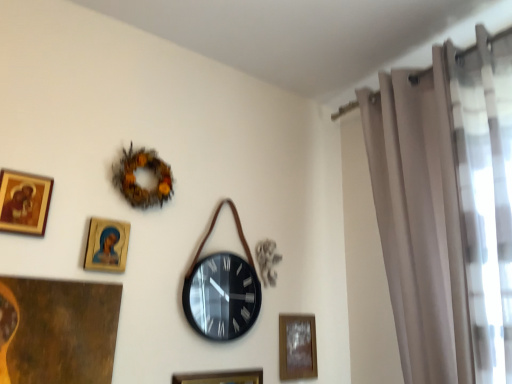
Question: Does beige sheer curtain at right have a greater height compared to wooden glossy picture frame at upper left, which is the 2th picture frame in top-to-bottom order?

Choices:
 (A) yes
 (B) no

Answer: (A)

Question: From the image's perspective, does beige sheer curtain at right appear lower than wooden glossy picture frame at upper left, the 3th picture frame positioned from the back?

Choices:
 (A) no
 (B) yes

Answer: (A)

Question: From a real-world perspective, is beige sheer curtain at right on wooden glossy picture frame at upper left, the 3th picture frame positioned from the back?

Choices:
 (A) no
 (B) yes

Answer: (B)

Question: Can you confirm if beige sheer curtain at right is positioned to the right of wooden glossy picture frame at upper left, which appears as the third picture frame when ordered from the bottom?

Choices:
 (A) no
 (B) yes

Answer: (B)

Question: Can you confirm if beige sheer curtain at right is shorter than wooden glossy picture frame at upper left, the 3th picture frame positioned from the back?

Choices:
 (A) no
 (B) yes

Answer: (A)

Question: Would you say wooden frame at lower center, which ranks as the second picture frame in bottom-to-top order, is to the left or to the right of brown textured wreath at upper center in the picture?

Choices:
 (A) left
 (B) right

Answer: (B)

Question: Does point (285, 352) appear closer or farther from the camera than point (161, 172)?

Choices:
 (A) farther
 (B) closer

Answer: (A)

Question: From the image's perspective, is wooden frame at lower center, which ranks as the 3th picture frame in top-to-bottom order, located above or below brown textured wreath at upper center?

Choices:
 (A) below
 (B) above

Answer: (A)

Question: In terms of height, does wooden frame at lower center, the 1th picture frame positioned from the back, look taller or shorter compared to brown textured wreath at upper center?

Choices:
 (A) tall
 (B) short

Answer: (A)

Question: In terms of width, does gold-framed picture at upper left, the 4th picture frame viewed from the back, look wider or thinner when compared to brown textured wreath at upper center?

Choices:
 (A) thin
 (B) wide

Answer: (A)

Question: In terms of size, does gold-framed picture at upper left, the 4th picture frame viewed from the back, appear bigger or smaller than brown textured wreath at upper center?

Choices:
 (A) small
 (B) big

Answer: (A)

Question: From the image's perspective, is gold-framed picture at upper left, the 4th picture frame positioned from the bottom, located above or below brown textured wreath at upper center?

Choices:
 (A) below
 (B) above

Answer: (A)

Question: Considering their positions, is gold-framed picture at upper left, the 4th picture frame viewed from the back, located in front of or behind brown textured wreath at upper center?

Choices:
 (A) behind
 (B) front

Answer: (B)

Question: From a real-world perspective, is brown textured wreath at upper center physically located above or below black matte wall clock at center?

Choices:
 (A) below
 (B) above

Answer: (B)

Question: Considering their positions, is brown textured wreath at upper center located in front of or behind black matte wall clock at center?

Choices:
 (A) front
 (B) behind

Answer: (A)